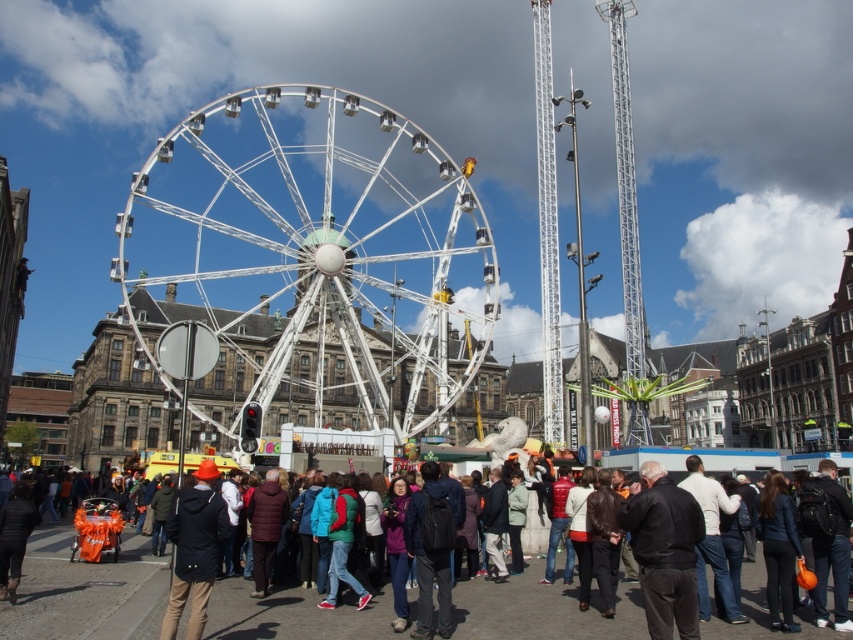
Does white metallic ferris wheel at center appear under orange fabric bag at center?

Actually, white metallic ferris wheel at center is above orange fabric bag at center.

Can you confirm if white metallic ferris wheel at center is positioned above orange fabric bag at center?

Yes, white metallic ferris wheel at center is above orange fabric bag at center.

Find the location of a particular element. This screenshot has height=640, width=853. white metallic ferris wheel at center is located at coordinates (323, 246).

Does orange fabric bag at center lie in front of matte black jacket at lower left?

That is False.

Which is in front, point (758, 612) or point (202, 499)?

Positioned in front is point (202, 499).

At what (x,y) coordinates should I click in order to perform the action: click on orange fabric bag at center. Please return your answer as a coordinate pair (x, y). The image size is (853, 640). Looking at the image, I should click on point(85,593).

Which is more to the left, orange fabric bag at center or black leather jacket at center?

orange fabric bag at center is more to the left.

I want to click on orange fabric bag at center, so click(85, 593).

The width and height of the screenshot is (853, 640). Find the location of `orange fabric bag at center`. orange fabric bag at center is located at coordinates (85, 593).